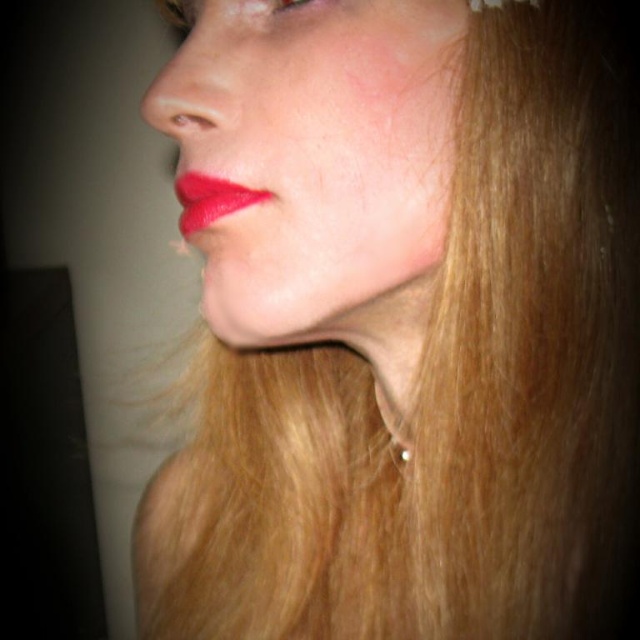
You are an artist trying to sketch this face. You need to decide the order to draw the points based on their depth. Which point should you draw first, point (189, 221) or point (403, 451)?

Point (189, 221) should be drawn first because it is closer to the viewer than point (403, 451).